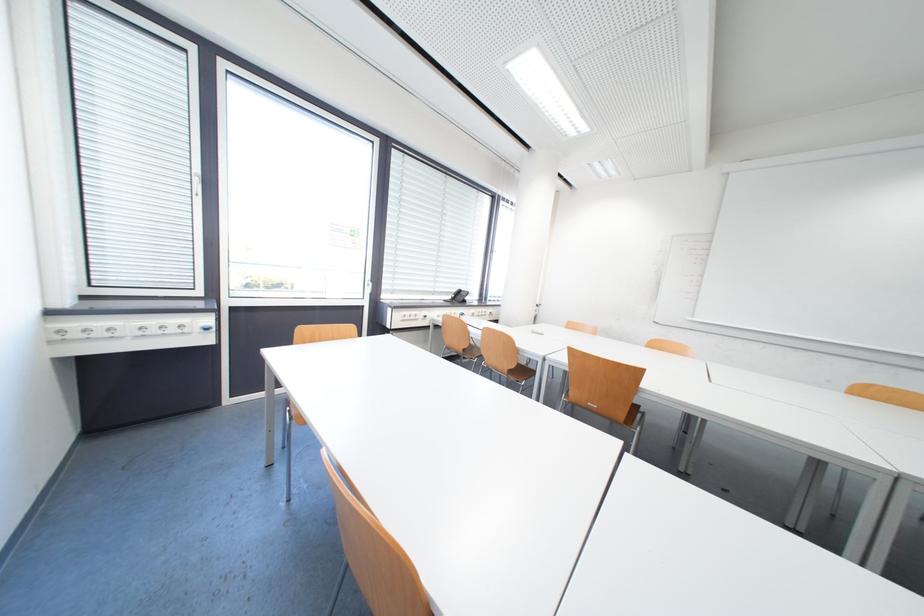
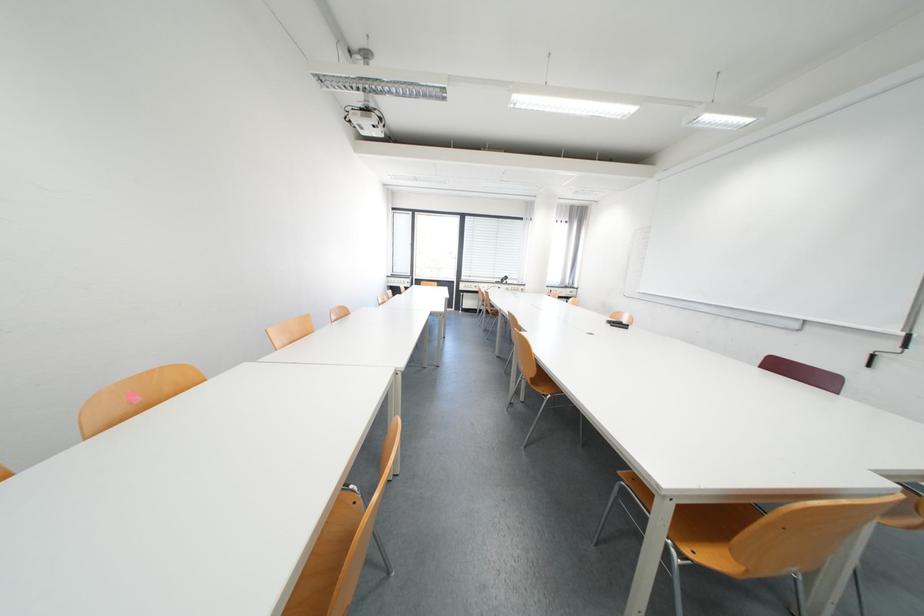
Locate, in the second image, the point that corresponds to point (463, 300) in the first image.

(512, 282)